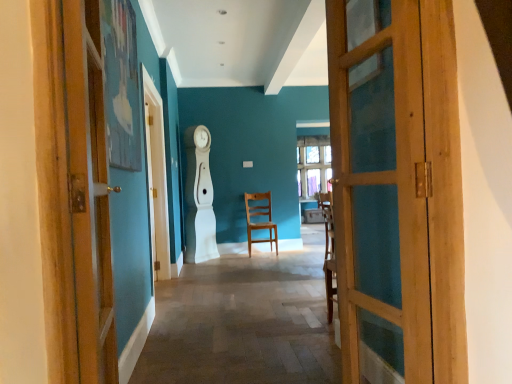
What is the approximate height of wooden door at right, marked as the second door in a left-to-right arrangement?

wooden door at right, marked as the second door in a left-to-right arrangement, is 1.55 meters tall.

Identify the location of wooden chair at center. (262, 222).

From the image's perspective, which one is positioned higher, wooden door at right, the 1th door viewed from the right, or wooden door at left, the first door viewed from the left?

From the image's view, wooden door at right, the 1th door viewed from the right, is above.

I want to click on door that appears in front of the wooden door at right, marked as the second door in a left-to-right arrangement, so click(x=106, y=186).

Is wooden door at right, the 1th door viewed from the right, beside wooden door at left, the first door viewed from the left?

No, wooden door at right, the 1th door viewed from the right, is not with wooden door at left, the first door viewed from the left.

Which is behind, point (341, 332) or point (128, 166)?

The point (128, 166) is more distant.

Based on the photo, from a real-world perspective, is wooden door at left, the first door viewed from the left, positioned above or below wooden door at right, marked as the second door in a left-to-right arrangement?

wooden door at left, the first door viewed from the left, is situated higher than wooden door at right, marked as the second door in a left-to-right arrangement, in the real world.

Does wooden door at left, positioned as the 2th door in right-to-left order, turn towards wooden door at right, the 1th door viewed from the right?

Result: Yes, wooden door at left, positioned as the 2th door in right-to-left order, is aimed at wooden door at right, the 1th door viewed from the right.

Does wooden door at left, positioned as the 2th door in right-to-left order, appear on the left side of wooden door at right, the 1th door viewed from the right?

Indeed, wooden door at left, positioned as the 2th door in right-to-left order, is positioned on the left side of wooden door at right, the 1th door viewed from the right.

Relative to wooden door at right, the 1th door viewed from the right, is wooden chair at center in front or behind?

wooden chair at center is positioned farther from the viewer than wooden door at right, the 1th door viewed from the right.

Is point (275, 234) farther from camera compared to point (379, 160)?

That is True.

Is wooden chair at center inside the boundaries of wooden door at right, marked as the second door in a left-to-right arrangement, or outside?

wooden chair at center lies outside wooden door at right, marked as the second door in a left-to-right arrangement.

In the image, is wooden chair at center on the left side or the right side of wooden door at right, marked as the second door in a left-to-right arrangement?

wooden chair at center is positioned on wooden door at right, marked as the second door in a left-to-right arrangement,'s left side.

Considering the sizes of objects wooden door at right, the 1th door viewed from the right, and wooden chair at center in the image provided, who is thinner, wooden door at right, the 1th door viewed from the right, or wooden chair at center?

wooden door at right, the 1th door viewed from the right.

Which is in front, point (392, 188) or point (262, 194)?

The point (392, 188) is more forward.

Is wooden door at right, marked as the second door in a left-to-right arrangement, looking in the opposite direction of wooden chair at center?

No.

From a real-world perspective, who is located lower, wooden door at right, the 1th door viewed from the right, or wooden chair at center?

From a 3D spatial view, wooden chair at center is below.

From a real-world perspective, between wooden chair at center and wooden door at left, the first door viewed from the left, who is vertically lower?

wooden chair at center is physically lower.

How much distance is there between wooden chair at center and wooden door at left, the first door viewed from the left?

wooden chair at center is 13.40 feet from wooden door at left, the first door viewed from the left.

Could you tell me if wooden chair at center is facing wooden door at left, positioned as the 2th door in right-to-left order?

Yes, wooden chair at center is aimed at wooden door at left, positioned as the 2th door in right-to-left order.

Considering the positions of objects wooden chair at center and wooden door at left, positioned as the 2th door in right-to-left order, in the image provided, who is in front, wooden chair at center or wooden door at left, positioned as the 2th door in right-to-left order,?

wooden door at left, positioned as the 2th door in right-to-left order, is in front.

The image size is (512, 384). I want to click on chair behind the wooden door at left, positioned as the 2th door in right-to-left order, so click(x=262, y=222).

Is wooden chair at center at the back of wooden door at left, the first door viewed from the left?

That's not correct — wooden door at left, the first door viewed from the left, is not looking away from wooden chair at center.

Can you tell me how much wooden door at left, the first door viewed from the left, and wooden chair at center differ in facing direction?

94.9 degrees.

I want to click on door in front of the wooden door at right, marked as the second door in a left-to-right arrangement, so click(x=106, y=186).

Locate an element on the screen. The height and width of the screenshot is (384, 512). door located above the wooden door at left, the first door viewed from the left (from the image's perspective) is located at coordinates (380, 189).

Which object lies further to the anchor point wooden door at left, positioned as the 2th door in right-to-left order, wooden chair at center or wooden door at right, marked as the second door in a left-to-right arrangement?

wooden chair at center.

Based on the photo, when comparing their distances from wooden chair at center, does wooden door at left, positioned as the 2th door in right-to-left order, or wooden door at right, the 1th door viewed from the right, seem closer?

Based on the image, wooden door at left, positioned as the 2th door in right-to-left order, appears to be nearer to wooden chair at center.

When comparing their distances from wooden door at right, the 1th door viewed from the right, does wooden door at left, the first door viewed from the left, or wooden chair at center seem closer?

wooden door at left, the first door viewed from the left, is closer to wooden door at right, the 1th door viewed from the right.

Which object lies nearer to the anchor point wooden chair at center, wooden door at right, the 1th door viewed from the right, or wooden door at left, positioned as the 2th door in right-to-left order?

Among the two, wooden door at left, positioned as the 2th door in right-to-left order, is located nearer to wooden chair at center.

From the image, which object appears to be nearer to wooden door at left, the first door viewed from the left, wooden door at right, marked as the second door in a left-to-right arrangement, or wooden chair at center?

wooden door at right, marked as the second door in a left-to-right arrangement, is closer to wooden door at left, the first door viewed from the left.

Estimate the real-world distances between objects in this image. Which object is closer to wooden door at right, marked as the second door in a left-to-right arrangement, wooden chair at center or wooden door at left, positioned as the 2th door in right-to-left order?

Among the two, wooden door at left, positioned as the 2th door in right-to-left order, is located nearer to wooden door at right, marked as the second door in a left-to-right arrangement.

What are the coordinates of `door between wooden door at left, positioned as the 2th door in right-to-left order, and wooden chair at center, along the z-axis` in the screenshot? It's located at (380, 189).